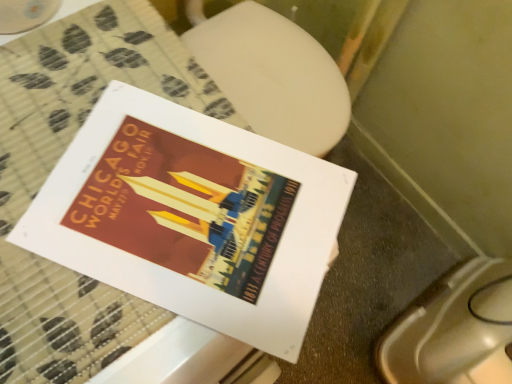
Question: Should I look upward or downward to see matte paper poster at center?

Choices:
 (A) up
 (B) down

Answer: (B)

Question: Considering the relative sizes of white glossy toilet bowl at lower right and matte paper poster at center in the image provided, is white glossy toilet bowl at lower right thinner than matte paper poster at center?

Choices:
 (A) yes
 (B) no

Answer: (B)

Question: From a real-world perspective, is white glossy toilet bowl at lower right physically below matte paper poster at center?

Choices:
 (A) yes
 (B) no

Answer: (A)

Question: From the image's perspective, does white glossy toilet bowl at lower right appear higher than matte paper poster at center?

Choices:
 (A) yes
 (B) no

Answer: (B)

Question: From a real-world perspective, does white glossy toilet bowl at lower right stand above matte paper poster at center?

Choices:
 (A) no
 (B) yes

Answer: (A)

Question: Is white glossy toilet bowl at lower right smaller than matte paper poster at center?

Choices:
 (A) no
 (B) yes

Answer: (A)

Question: Considering the relative sizes of white glossy toilet bowl at lower right and matte paper poster at center in the image provided, is white glossy toilet bowl at lower right taller than matte paper poster at center?

Choices:
 (A) yes
 (B) no

Answer: (A)

Question: Is white glossy toilet bowl at lower right located within matte paper poster at center?

Choices:
 (A) yes
 (B) no

Answer: (B)

Question: Can you confirm if matte paper poster at center is thinner than white glossy toilet bowl at lower right?

Choices:
 (A) yes
 (B) no

Answer: (A)

Question: Is matte paper poster at center facing away from white glossy toilet bowl at lower right?

Choices:
 (A) yes
 (B) no

Answer: (B)

Question: Can you confirm if matte paper poster at center is smaller than white glossy toilet bowl at lower right?

Choices:
 (A) yes
 (B) no

Answer: (A)

Question: Is matte paper poster at center taller than white glossy toilet bowl at lower right?

Choices:
 (A) no
 (B) yes

Answer: (A)

Question: From a real-world perspective, is matte paper poster at center physically above white glossy toilet bowl at lower right?

Choices:
 (A) no
 (B) yes

Answer: (B)

Question: Considering the positions of matte paper poster at center and white glossy toilet bowl at lower right in the image, is matte paper poster at center bigger or smaller than white glossy toilet bowl at lower right?

Choices:
 (A) big
 (B) small

Answer: (B)